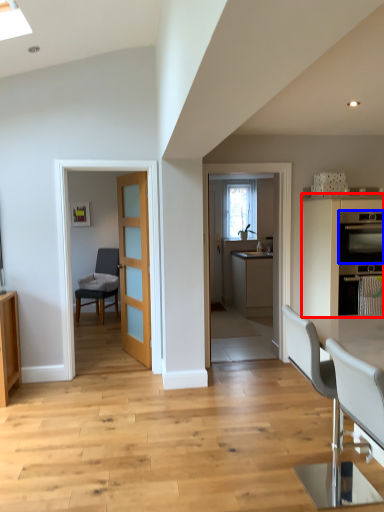
Question: Which object appears farthest to the camera in this image, cabinetry (highlighted by a red box) or kitchen appliance (highlighted by a blue box)?

Choices:
 (A) cabinetry
 (B) kitchen appliance

Answer: (B)